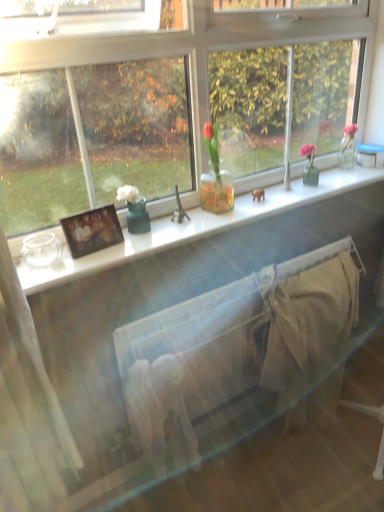
Question: From a real-world perspective, relative to beige cotton blanket at lower right, is white glossy window sill at center vertically above or below?

Choices:
 (A) above
 (B) below

Answer: (A)

Question: Based on their positions, is white glossy window sill at center located to the left or right of beige cotton blanket at lower right?

Choices:
 (A) left
 (B) right

Answer: (A)

Question: Based on their relative distances, which object is farther from the white fabric bed frame at center?

Choices:
 (A) beige cotton blanket at lower right
 (B) matte wooden picture frame at left
 (C) white glossy window sill at center

Answer: (B)

Question: Based on their relative distances, which object is nearer to the matte wooden picture frame at left?

Choices:
 (A) white glossy window sill at center
 (B) white fabric bed frame at center
 (C) beige cotton blanket at lower right

Answer: (A)